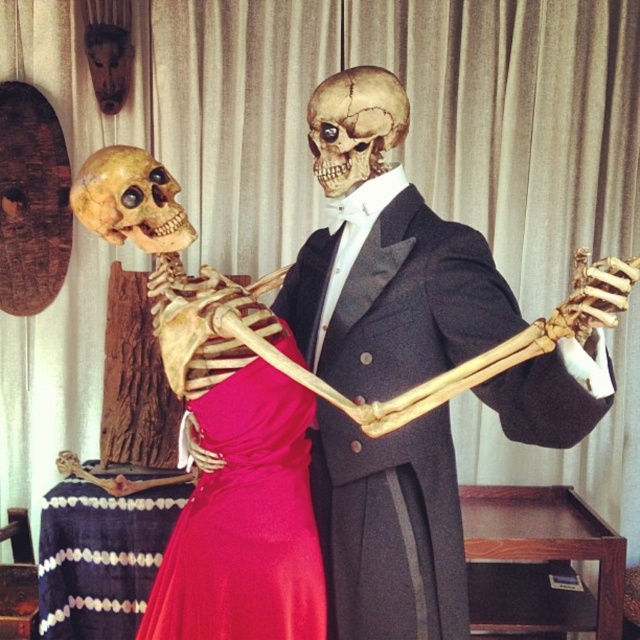
Question: Is matte pink dress at center to the left of golden matte skull at center from the viewer's perspective?

Choices:
 (A) no
 (B) yes

Answer: (A)

Question: Can you confirm if shiny red fabric dress at center is smaller than smooth beige skull at center?

Choices:
 (A) no
 (B) yes

Answer: (A)

Question: Is smooth beige skull at center further to camera compared to golden matte skull at center?

Choices:
 (A) yes
 (B) no

Answer: (A)

Question: Among these points, which one is farthest from the camera?

Choices:
 (A) (365, 548)
 (B) (72, 188)

Answer: (A)

Question: Estimate the real-world distances between objects in this image. Which object is closer to the golden matte skull at center?

Choices:
 (A) matte pink dress at center
 (B) smooth beige skull at center

Answer: (B)

Question: Which point appears closest to the camera in this image?

Choices:
 (A) (234, 582)
 (B) (148, 173)
 (C) (332, 97)
 (D) (376, 387)

Answer: (A)